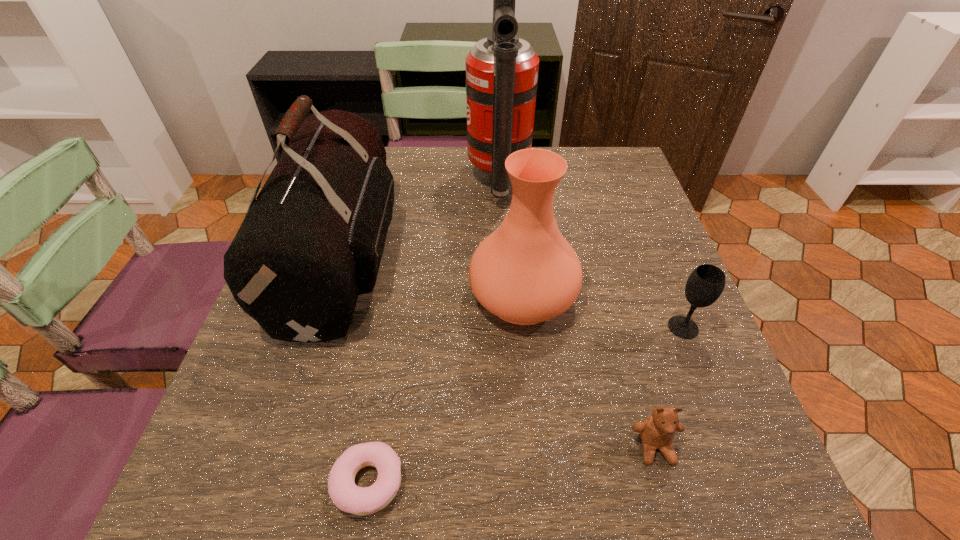
This screenshot has width=960, height=540. I want to click on wineglass at the right edge, so click(x=706, y=283).

Identify the location of teddy bear located at the right edge. (657, 431).

Where is `object present at the far left corner`? object present at the far left corner is located at coordinates (312, 241).

You are a GUI agent. You are given a task and a screenshot of the screen. Output one action in this format:
    pyautogui.click(x=<x>, y=<y>)
    Task: Click on the object present at the near right corner
    This screenshot has width=960, height=540.
    Given the screenshot: What is the action you would take?
    (x=657, y=431)

In the image, there is a desktop. Where is `vacant space at the left edge`? The height and width of the screenshot is (540, 960). vacant space at the left edge is located at coordinates (244, 448).

Where is `blank space at the right edge of the desktop`? Image resolution: width=960 pixels, height=540 pixels. blank space at the right edge of the desktop is located at coordinates (605, 252).

Where is `vacant space at the far right corner of the desktop`? Image resolution: width=960 pixels, height=540 pixels. vacant space at the far right corner of the desktop is located at coordinates (619, 152).

In the image, there is a desktop. Where is `vacant area at the near right corner`? vacant area at the near right corner is located at coordinates 668,481.

The height and width of the screenshot is (540, 960). What are the coordinates of `free point between the fourth tallest object and the fire extinguisher` in the screenshot? It's located at (591, 254).

Where is `vacant space that's between the second shortest object and the duffel bag`? vacant space that's between the second shortest object and the duffel bag is located at coordinates (498, 352).